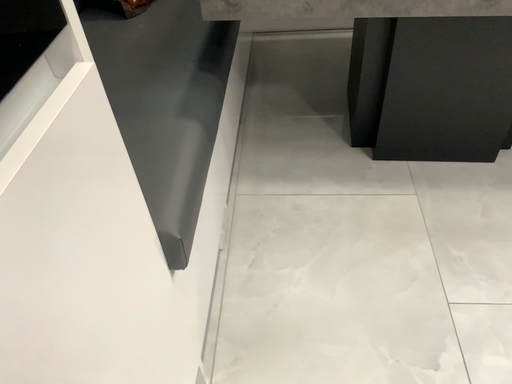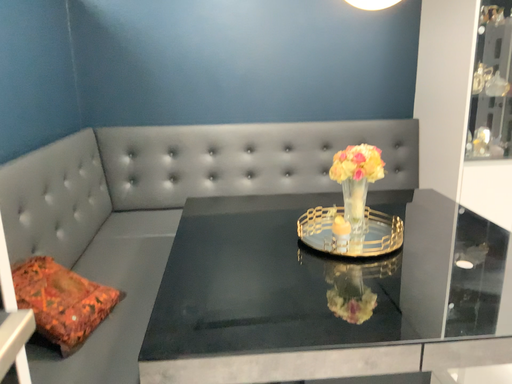
Question: Which way did the camera rotate in the video?

Choices:
 (A) rotated downward
 (B) rotated upward

Answer: (B)